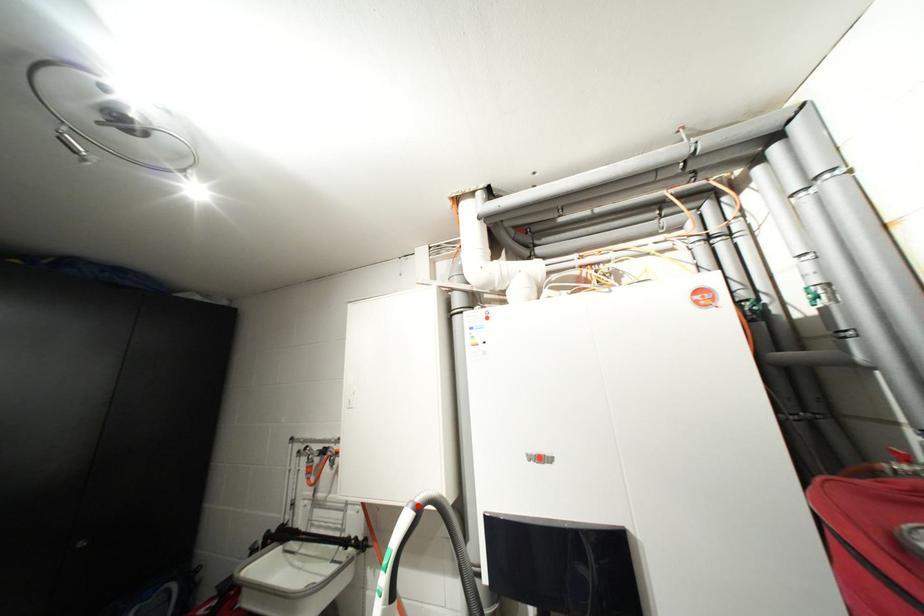
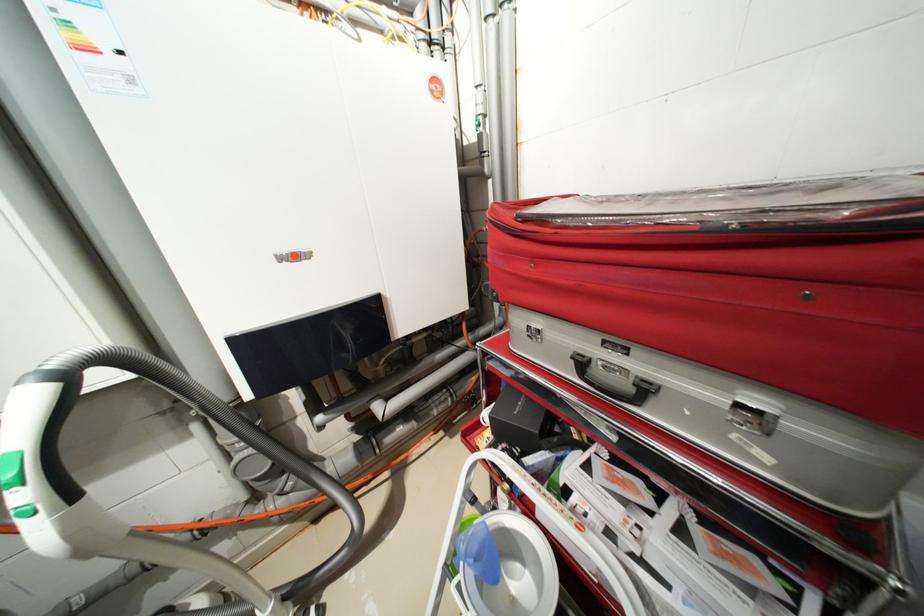
Where in the second image is the point corresponding to the highlighted location from the first image?

(40, 379)